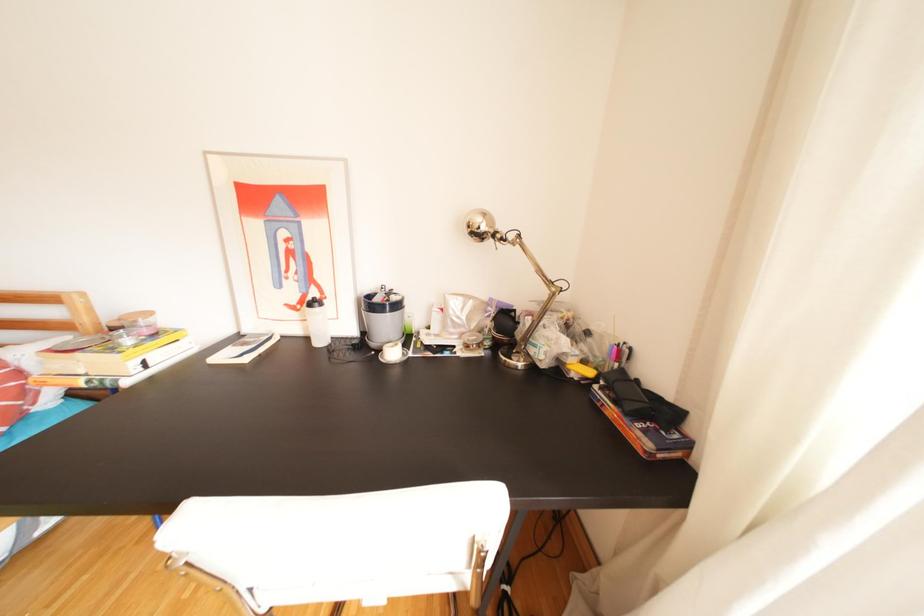
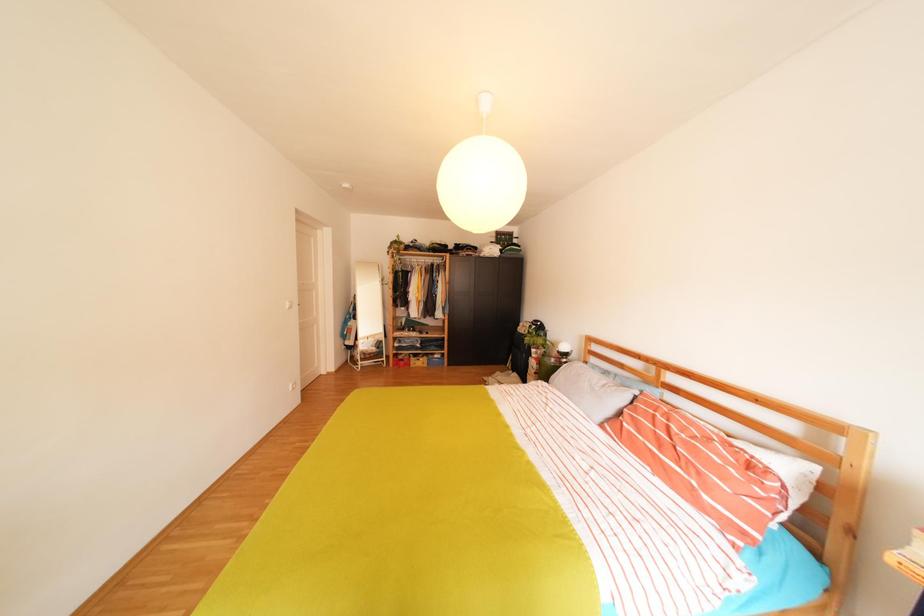
Question: The camera is either moving clockwise (left) or counter-clockwise (right) around the object. The first image is from the beginning of the video and the second image is from the end. Is the camera moving left or right when shooting the video?

Choices:
 (A) Left
 (B) Right

Answer: (B)